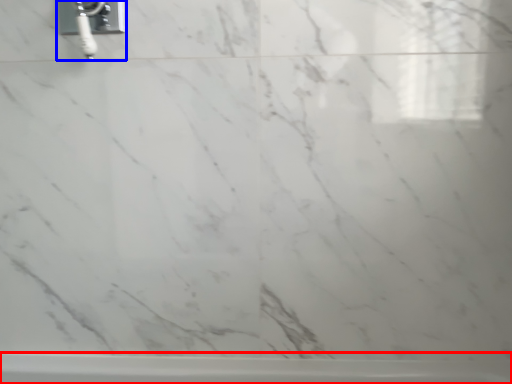
Question: Which object is closer to the camera taking this photo, bathtub (highlighted by a red box) or plumbing fixture (highlighted by a blue box)?

Choices:
 (A) bathtub
 (B) plumbing fixture

Answer: (B)